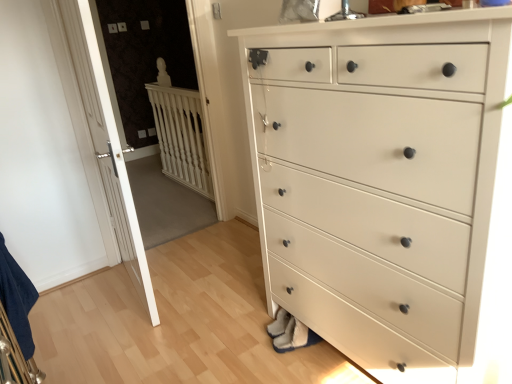
The height and width of the screenshot is (384, 512). What are the coordinates of `free region under white wooden door at left (from a real-world perspective)` in the screenshot? It's located at (138, 288).